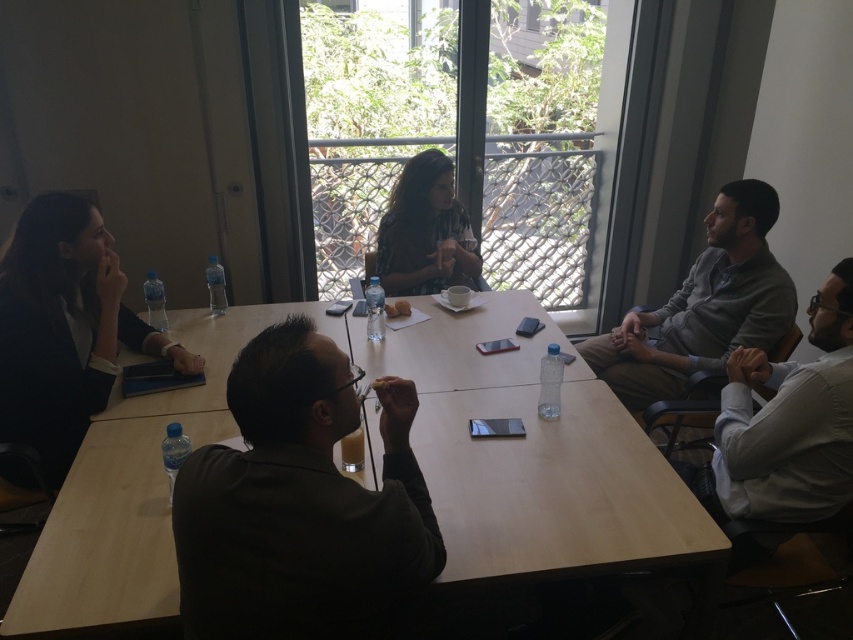
Question: Which object is farther from the camera taking this photo?

Choices:
 (A) black fabric jacket at left
 (B) matte black shirt at center
 (C) wooden table at center
 (D) white shirt at right

Answer: (B)

Question: Can you confirm if black fabric jacket at left is bigger than white shirt at right?

Choices:
 (A) yes
 (B) no

Answer: (A)

Question: Is wooden table at center closer to the viewer compared to white shirt at right?

Choices:
 (A) yes
 (B) no

Answer: (A)

Question: Based on their relative distances, which object is nearer to the dark green shirt at center?

Choices:
 (A) gray cotton shirt at right
 (B) white shirt at right
 (C) black fabric jacket at left
 (D) wooden table at center

Answer: (D)

Question: Based on their relative distances, which object is farther from the gray cotton shirt at right?

Choices:
 (A) matte black shirt at center
 (B) dark green shirt at center

Answer: (B)

Question: Considering the relative positions of white shirt at right and matte black shirt at center in the image provided, where is white shirt at right located with respect to matte black shirt at center?

Choices:
 (A) right
 (B) left

Answer: (A)